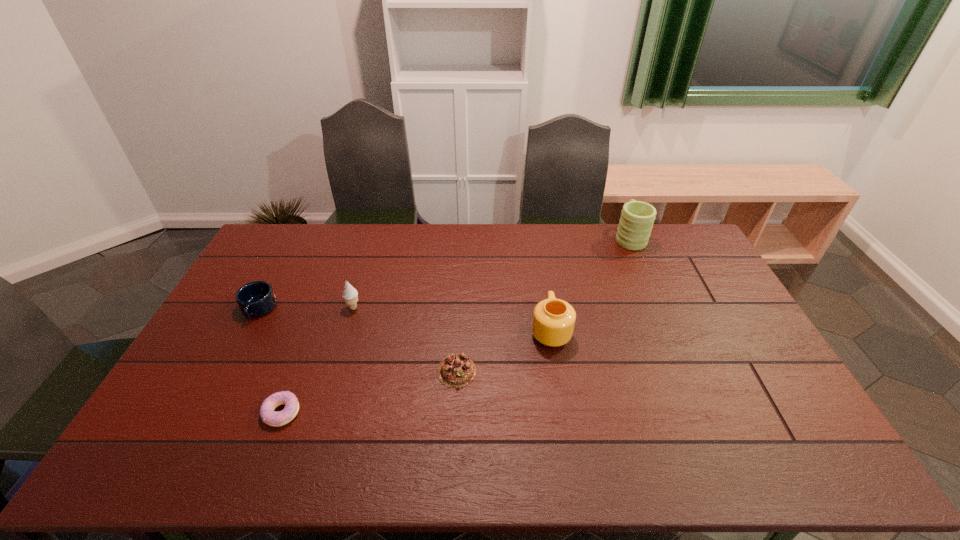
Identify the location of the fifth object from right to left. (269, 416).

Image resolution: width=960 pixels, height=540 pixels. In order to click on free point located 0.200m on the handle side of the fifth object from left to right in this screenshot , I will do `click(541, 271)`.

Locate an element on the screen. This screenshot has width=960, height=540. vacant point located on the handle side of the fifth object from left to right is located at coordinates (538, 252).

Locate an element on the screen. This screenshot has width=960, height=540. vacant region located 0.250m on the handle side of the fifth object from left to right is located at coordinates (540, 262).

I want to click on free space located 0.290m on the front-facing side of the icecream, so click(x=328, y=390).

Where is `vacant space located 0.190m with the handle on the side of the leftmost mug`? Image resolution: width=960 pixels, height=540 pixels. vacant space located 0.190m with the handle on the side of the leftmost mug is located at coordinates (224, 374).

This screenshot has height=540, width=960. Find the location of `vacant space positioned on the right of the chocolate cake`. vacant space positioned on the right of the chocolate cake is located at coordinates (608, 371).

Identify the location of free space located 0.330m on the right of the shortest object. 427,412.

Find the location of a particular element. This screenshot has width=960, height=540. object that is positioned at the far edge is located at coordinates (637, 218).

Locate an element on the screen. The height and width of the screenshot is (540, 960). object positioned at the left edge is located at coordinates (255, 299).